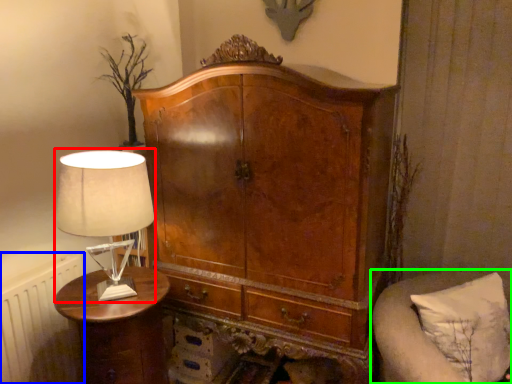
Question: Estimate the real-world distances between objects in this image. Which object is farther from table lamp (highlighted by a red box), radiator (highlighted by a blue box) or furniture (highlighted by a green box)?

Choices:
 (A) radiator
 (B) furniture

Answer: (B)